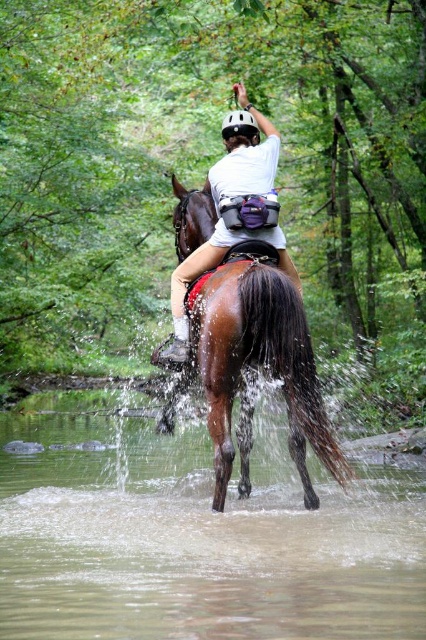
Question: In this image, where is brown glossy horse at center located relative to white matte helmet at upper center?

Choices:
 (A) left
 (B) right

Answer: (A)

Question: Is brown glossy horse at center to the left of white matte helmet at upper center from the viewer's perspective?

Choices:
 (A) yes
 (B) no

Answer: (A)

Question: Which point appears farthest from the camera in this image?

Choices:
 (A) (195, 316)
 (B) (172, 276)

Answer: (B)

Question: Can you confirm if brown glossy water at lower center is positioned to the right of white matte helmet at upper center?

Choices:
 (A) no
 (B) yes

Answer: (A)

Question: Which point is farther from the camera taking this photo?

Choices:
 (A) (204, 353)
 (B) (83, 618)
 (C) (238, 140)

Answer: (C)

Question: Which object is the farthest from the brown glossy water at lower center?

Choices:
 (A) brown glossy horse at center
 (B) white matte helmet at upper center

Answer: (B)